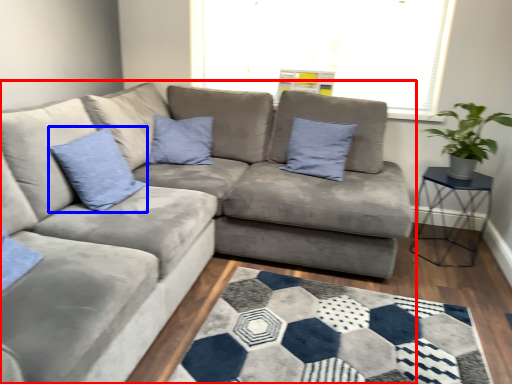
Question: Which point is closer to the camera, studio couch (highlighted by a red box) or pillow (highlighted by a blue box)?

Choices:
 (A) studio couch
 (B) pillow

Answer: (A)